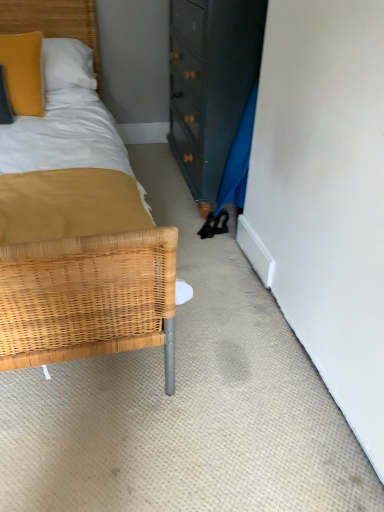
Question: Relative to matte yellow pillow at upper left, is woven wood headboard at upper left in front or behind?

Choices:
 (A) front
 (B) behind

Answer: (B)

Question: From the image's perspective, is woven wood headboard at upper left above or below matte yellow pillow at upper left?

Choices:
 (A) above
 (B) below

Answer: (A)

Question: Is woven wood headboard at upper left spatially inside matte yellow pillow at upper left, or outside of it?

Choices:
 (A) outside
 (B) inside

Answer: (A)

Question: Does point (13, 110) appear closer or farther from the camera than point (84, 36)?

Choices:
 (A) closer
 (B) farther

Answer: (A)

Question: Is matte yellow pillow at upper left taller or shorter than woven wood headboard at upper left?

Choices:
 (A) short
 (B) tall

Answer: (A)

Question: Is matte yellow pillow at upper left inside or outside of woven wood headboard at upper left?

Choices:
 (A) outside
 (B) inside

Answer: (B)

Question: Considering the positions of matte yellow pillow at upper left and woven wood headboard at upper left in the image, is matte yellow pillow at upper left wider or thinner than woven wood headboard at upper left?

Choices:
 (A) wide
 (B) thin

Answer: (B)